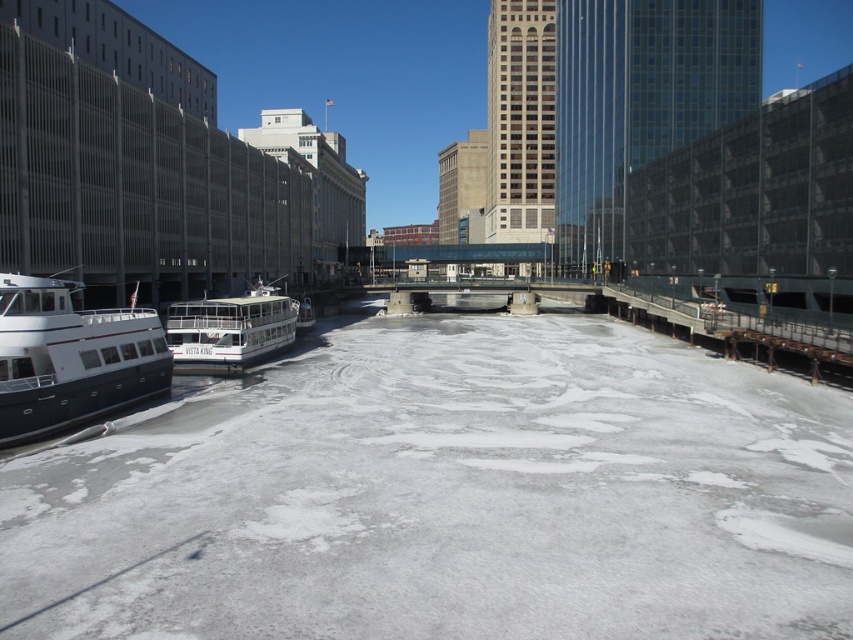
Question: Which of the following is the farthest from the observer?

Choices:
 (A) (120, 392)
 (B) (218, 317)

Answer: (B)

Question: Which point is farther to the camera?

Choices:
 (A) (24, 300)
 (B) (242, 317)

Answer: (B)

Question: Is matte white boat at left above white matte boat at center?

Choices:
 (A) no
 (B) yes

Answer: (A)

Question: Can you confirm if matte white boat at left is bigger than white matte boat at center?

Choices:
 (A) no
 (B) yes

Answer: (A)

Question: Which object is farther from the camera taking this photo?

Choices:
 (A) white matte boat at center
 (B) matte white boat at left

Answer: (A)

Question: Can you confirm if matte white boat at left is positioned below white matte boat at center?

Choices:
 (A) yes
 (B) no

Answer: (A)